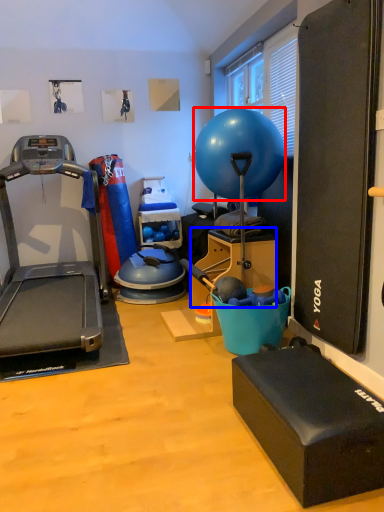
Question: Among these objects, which one is farthest to the camera, ball (highlighted by a red box) or box (highlighted by a blue box)?

Choices:
 (A) ball
 (B) box

Answer: (B)